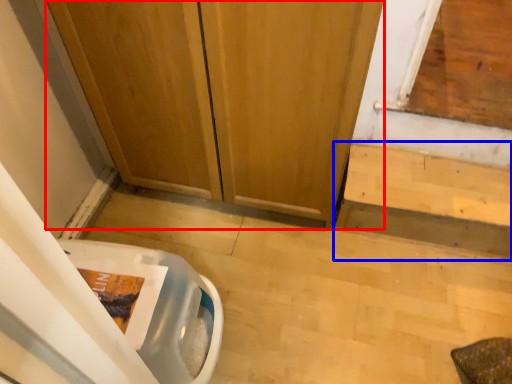
Question: Which object appears farthest to the camera in this image, door (highlighted by a red box) or stairwell (highlighted by a blue box)?

Choices:
 (A) door
 (B) stairwell

Answer: (B)